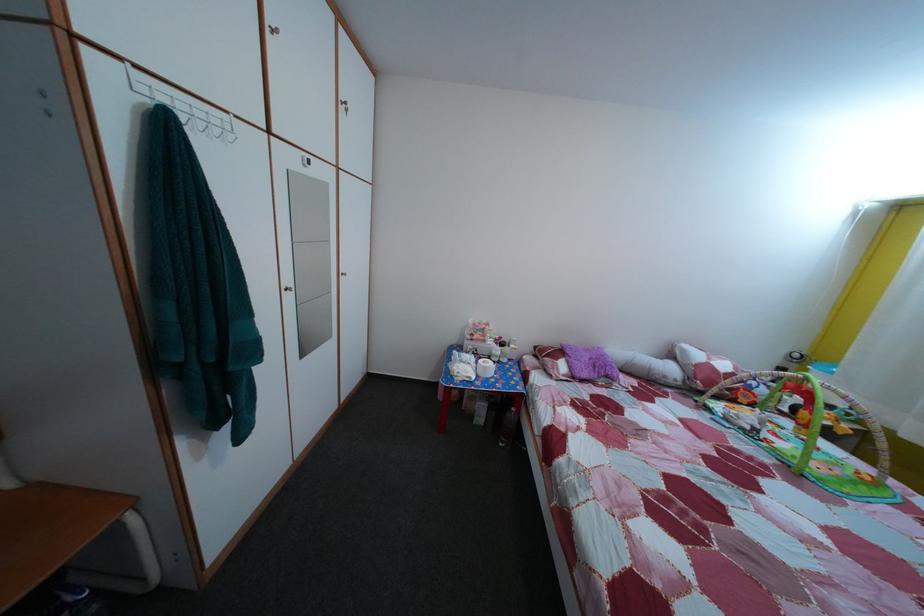
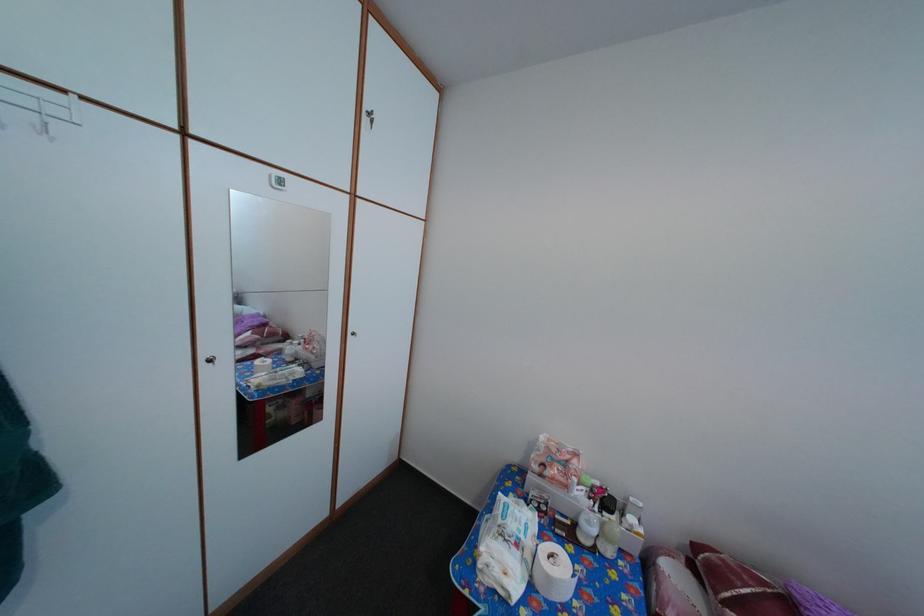
In the second image, find the point that corresponds to pixel 492 337 in the first image.

(576, 469)